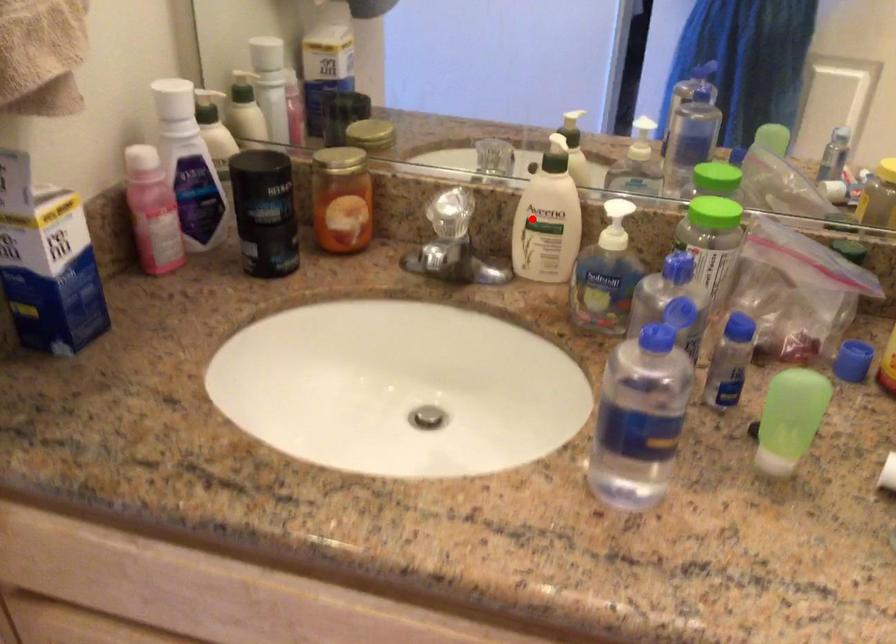
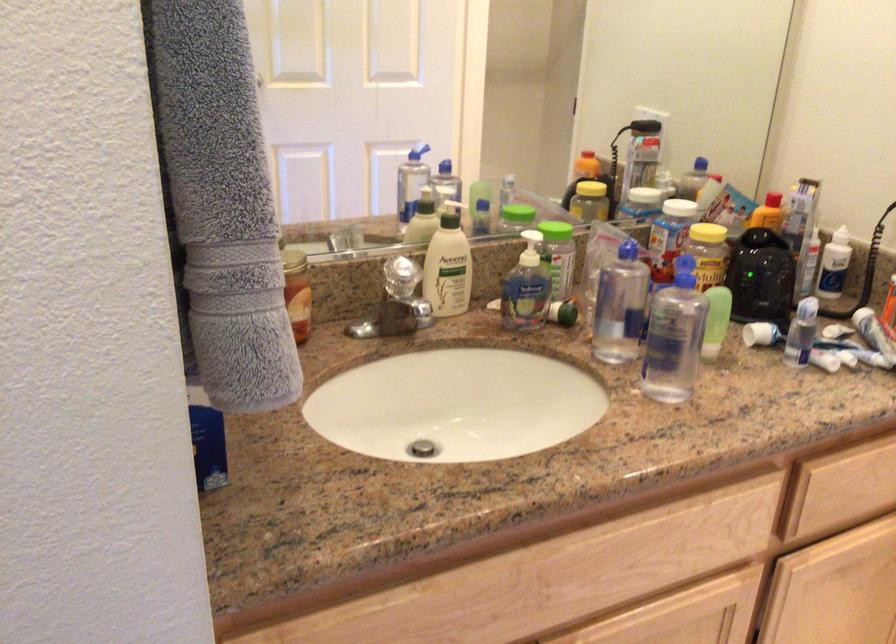
Question: I am providing you with two images of the same scene from different viewpoints. In image1, a red point is highlighted. Considering the same 3D point in image2, which of the following is correct?

Choices:
 (A) It is closer
 (B) It is farther

Answer: (B)